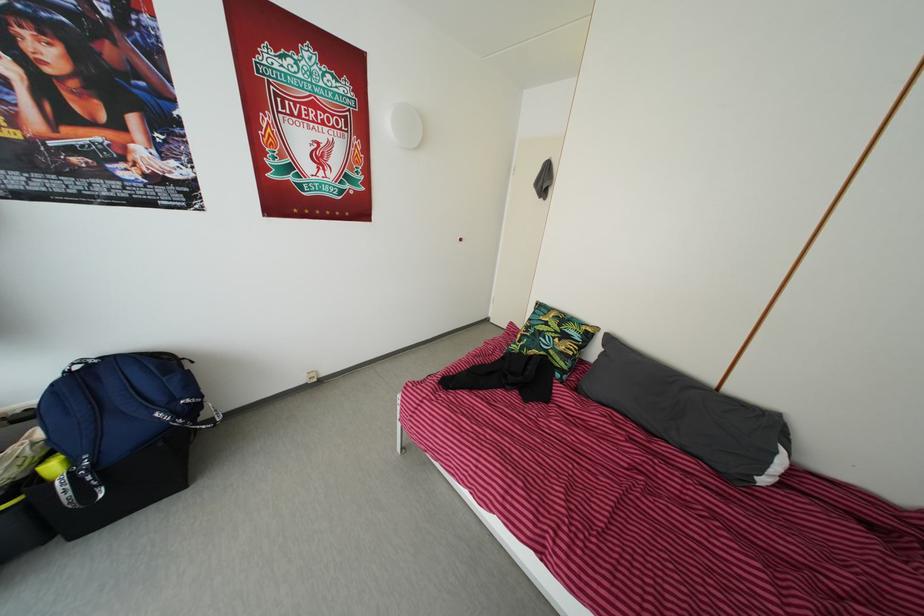
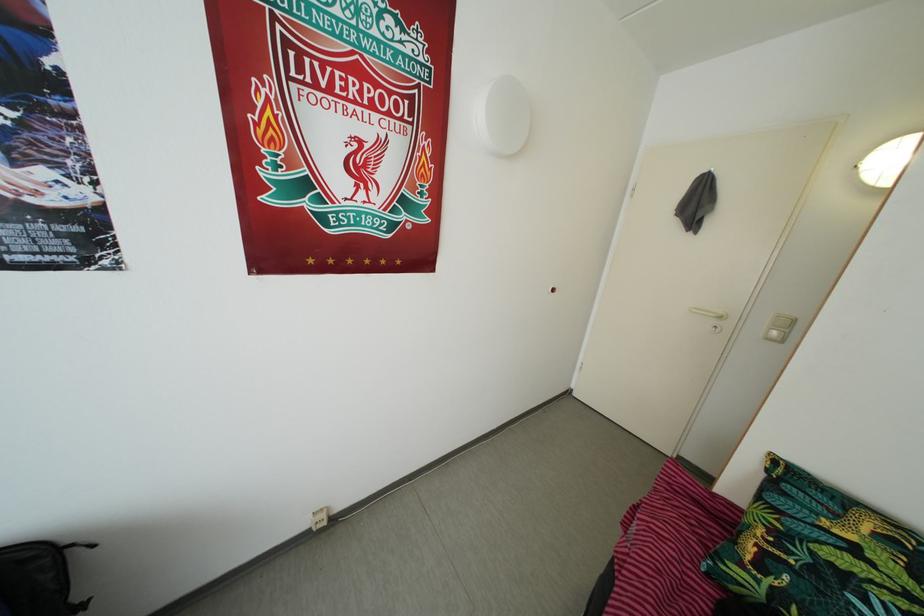
Where in the second image is the point corresponding to (540,342) from the first image?

(820, 578)